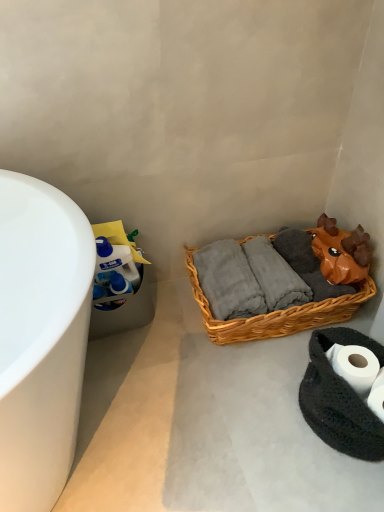
Where is `black knitted rug at lower right`? The height and width of the screenshot is (512, 384). black knitted rug at lower right is located at coordinates (340, 398).

In order to click on woven brown basket at center in this screenshot , I will do `click(276, 313)`.

This screenshot has width=384, height=512. In order to click on black knitted rug at lower right in this screenshot , I will do `click(340, 398)`.

This screenshot has height=512, width=384. I want to click on picnic basket above the white matte toilet paper at lower right (from the image's perspective), so click(x=276, y=313).

From their relative heights in the image, would you say woven brown basket at center is taller or shorter than white matte toilet paper at lower right?

Considering their sizes, woven brown basket at center has more height than white matte toilet paper at lower right.

From the image's perspective, which is below, woven brown basket at center or white matte toilet paper at lower right?

white matte toilet paper at lower right, from the image's perspective.

Could you tell me if black knitted rug at lower right is turned towards white matte toilet paper at lower right?

Yes, black knitted rug at lower right is turned towards white matte toilet paper at lower right.

Is black knitted rug at lower right far away from white matte toilet paper at lower right?

No, black knitted rug at lower right is in close proximity to white matte toilet paper at lower right.

Where is `material lying in front of the white matte toilet paper at lower right`? This screenshot has height=512, width=384. material lying in front of the white matte toilet paper at lower right is located at coordinates (340, 398).

Can we say black knitted rug at lower right lies outside white matte toilet paper at lower right?

Absolutely, black knitted rug at lower right is external to white matte toilet paper at lower right.

Would you say white matte toilet paper at lower right is inside or outside woven brown basket at center?

white matte toilet paper at lower right exists outside the volume of woven brown basket at center.

How many degrees apart are the facing directions of white matte toilet paper at lower right and woven brown basket at center?

The angle between the facing direction of white matte toilet paper at lower right and the facing direction of woven brown basket at center is 30.7 degrees.

Who is taller, white matte toilet paper at lower right or woven brown basket at center?

Standing taller between the two is woven brown basket at center.

Is white matte toilet paper at lower right facing away from woven brown basket at center?

No, white matte toilet paper at lower right's orientation is not away from woven brown basket at center.

From the image's perspective, would you say woven brown basket at center is positioned over black knitted rug at lower right?

Correct, woven brown basket at center appears higher than black knitted rug at lower right in the image.

Consider the image. Which is more to the right, woven brown basket at center or black knitted rug at lower right?

black knitted rug at lower right is more to the right.

From a real-world perspective, is woven brown basket at center below black knitted rug at lower right?

Actually, woven brown basket at center is physically above black knitted rug at lower right in the real world.

In the image, is white matte toilet paper at lower right positioned in front of or behind black knitted rug at lower right?

white matte toilet paper at lower right is positioned farther from the viewer than black knitted rug at lower right.

From the image's perspective, is white matte toilet paper at lower right on black knitted rug at lower right?

Yes, from the image's perspective, white matte toilet paper at lower right is on top of black knitted rug at lower right.

From a real-world perspective, is black knitted rug at lower right physically located above or below woven brown basket at center?

Clearly, from a real-world perspective, black knitted rug at lower right is below woven brown basket at center.

Can we say black knitted rug at lower right lies outside woven brown basket at center?

Yes.

Is black knitted rug at lower right positioned with its back to woven brown basket at center?

No, black knitted rug at lower right is not facing away from woven brown basket at center.

Considering the sizes of black knitted rug at lower right and woven brown basket at center in the image, is black knitted rug at lower right taller or shorter than woven brown basket at center?

black knitted rug at lower right is shorter than woven brown basket at center.

You are a GUI agent. You are given a task and a screenshot of the screen. Output one action in this format:
    pyautogui.click(x=<x>, y=<y>)
    Task: Click on the picnic basket directly beneath the white matte toilet paper at lower right (from a real-world perspective)
    
    Given the screenshot: What is the action you would take?
    pyautogui.click(x=276, y=313)

Find the location of a particular element. Image resolution: width=384 pixels, height=512 pixels. toilet paper that is behind the black knitted rug at lower right is located at coordinates (356, 366).

Looking at the image, which one is located closer to black knitted rug at lower right, woven brown basket at center or white matte toilet paper at lower right?

white matte toilet paper at lower right.

Estimate the real-world distances between objects in this image. Which object is further from white matte toilet paper at lower right, woven brown basket at center or black knitted rug at lower right?

woven brown basket at center is positioned further to the anchor white matte toilet paper at lower right.

Consider the image. Which object lies nearer to the anchor point woven brown basket at center, white matte toilet paper at lower right or black knitted rug at lower right?

black knitted rug at lower right.

When comparing their distances from woven brown basket at center, does black knitted rug at lower right or white matte toilet paper at lower right seem further?

Among the two, white matte toilet paper at lower right is located further to woven brown basket at center.

When comparing their distances from black knitted rug at lower right, does white matte toilet paper at lower right or woven brown basket at center seem closer?

white matte toilet paper at lower right is positioned closer to the anchor black knitted rug at lower right.

Based on their spatial positions, is black knitted rug at lower right or woven brown basket at center further from white matte toilet paper at lower right?

The object further to white matte toilet paper at lower right is woven brown basket at center.

This screenshot has width=384, height=512. What are the coordinates of `toilet paper that lies between woven brown basket at center and black knitted rug at lower right from top to bottom` in the screenshot? It's located at (356, 366).